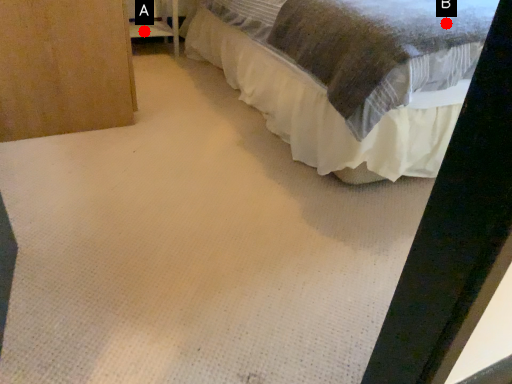
Question: Two points are circled on the image, labeled by A and B beside each circle. Which of the following is the closest to the observer?

Choices:
 (A) A is closer
 (B) B is closer

Answer: (B)